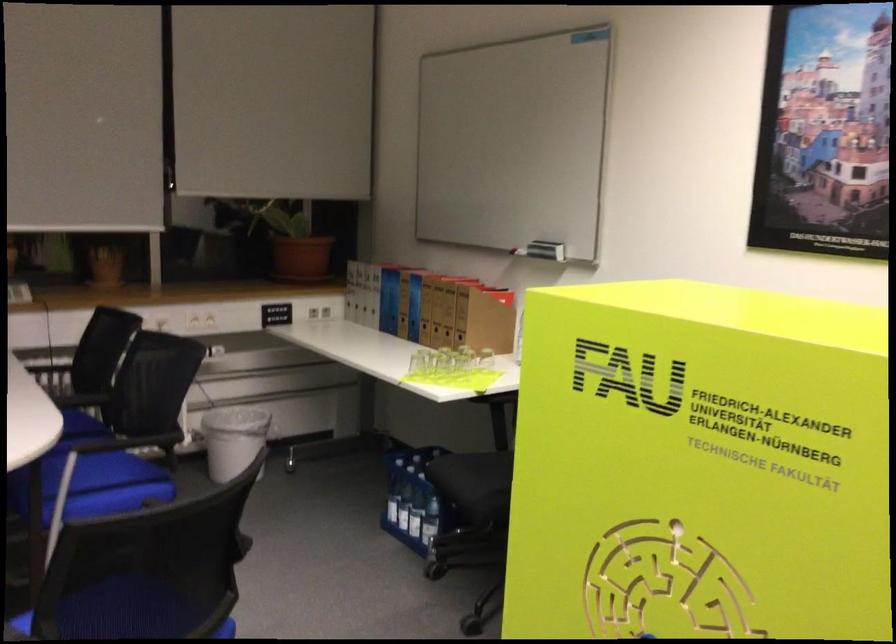
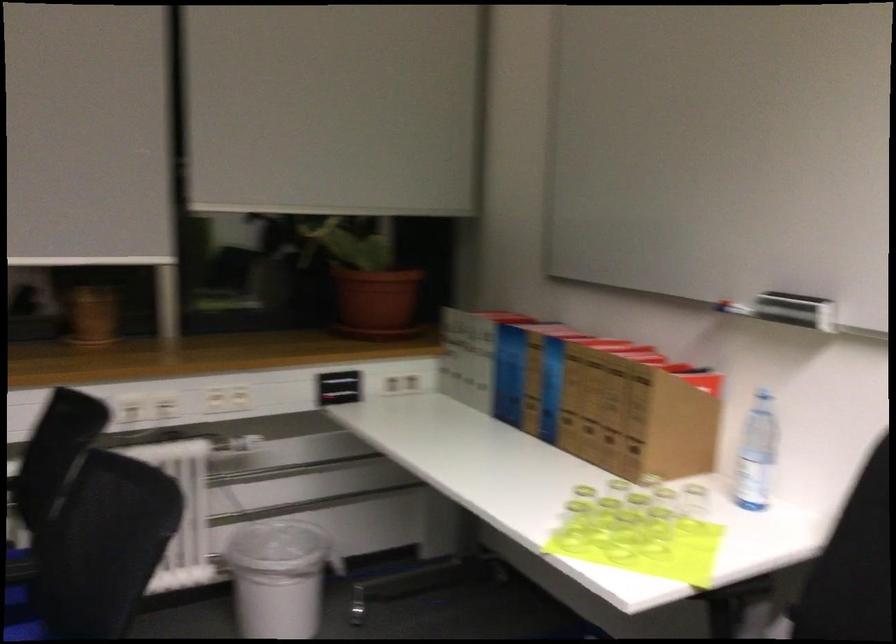
Locate, in the second image, the point that corresponds to point 467,374 in the first image.

(655, 534)